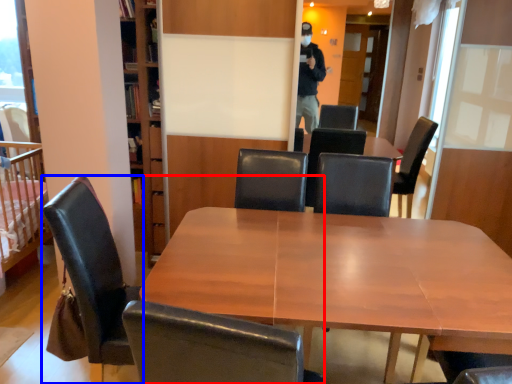
Question: Which point is closer to the camera, chair (highlighted by a red box) or chair (highlighted by a blue box)?

Choices:
 (A) chair
 (B) chair

Answer: (A)